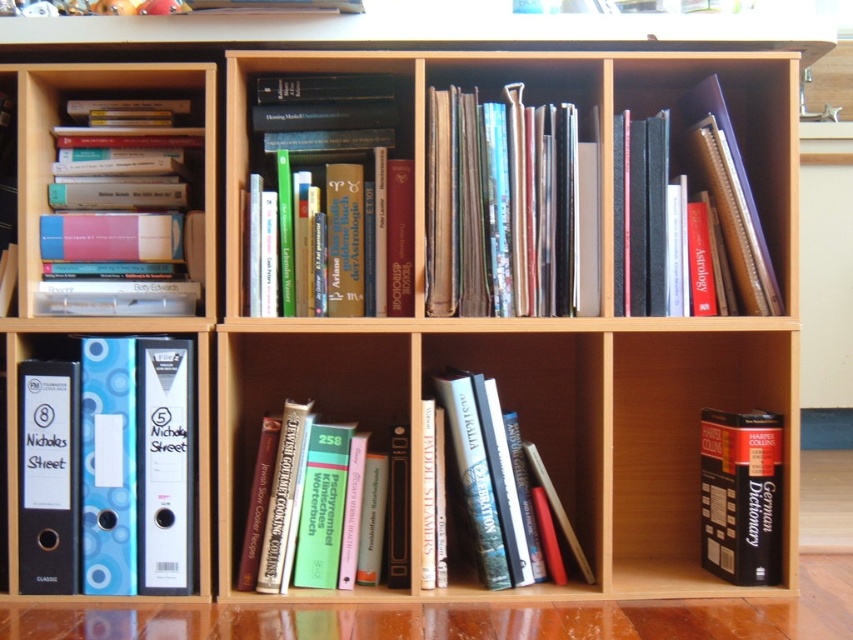
Is point (109, 586) positioned behind point (346, 244)?

That is False.

Can you confirm if blue glossy folder at left is positioned to the left of hardcover books at center?

Yes, blue glossy folder at left is to the left of hardcover books at center.

You are a GUI agent. You are given a task and a screenshot of the screen. Output one action in this format:
    pyautogui.click(x=<x>, y=<y>)
    Task: Click on the blue glossy folder at left
    The image size is (853, 640).
    Given the screenshot: What is the action you would take?
    pyautogui.click(x=109, y=468)

Between matte hardcover books at upper left and green paperback book at center, which one has less height?

Standing shorter between the two is green paperback book at center.

From the picture: Measure the distance between point (44, 284) and camera.

The distance of point (44, 284) from camera is 1.34 meters.

Where is `matte hardcover books at upper left`? The height and width of the screenshot is (640, 853). matte hardcover books at upper left is located at coordinates (123, 224).

Where is `matte hardcover books at upper left`? The image size is (853, 640). matte hardcover books at upper left is located at coordinates (123, 224).

Who is higher up, shiny metallic books at center or green paperback book at center?

shiny metallic books at center

Who is positioned more to the right, shiny metallic books at center or green paperback book at center?

From the viewer's perspective, shiny metallic books at center appears more on the right side.

Which is in front, point (474, 291) or point (318, 492)?

Point (318, 492) is more forward.

Where is `shiny metallic books at center`? The width and height of the screenshot is (853, 640). shiny metallic books at center is located at coordinates (509, 209).